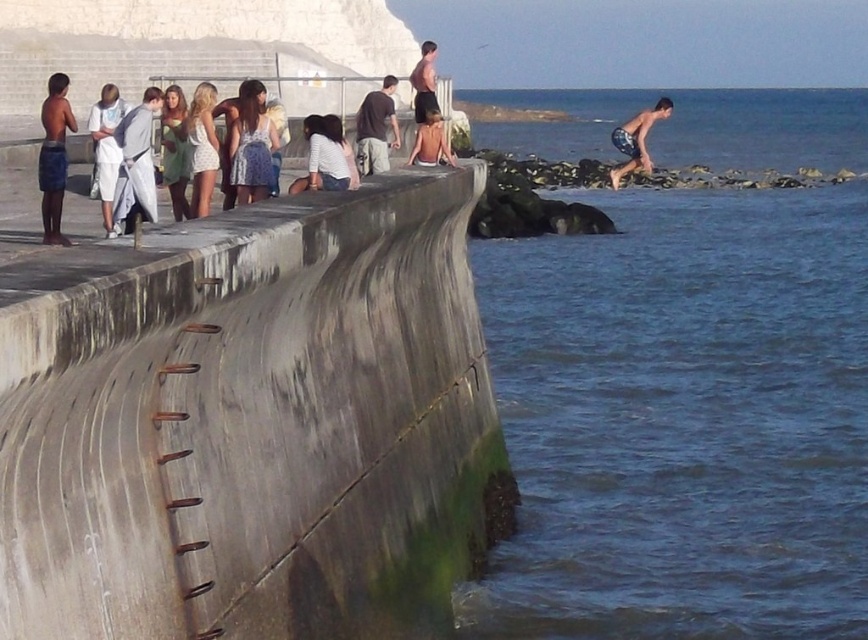
Question: Estimate the real-world distances between objects in this image. Which object is closer to the white cotton dress at left?

Choices:
 (A) matte blue shorts at left
 (B) smooth rock coast at right
 (C) matte skin at center

Answer: (A)

Question: Considering the real-world distances, which object is farthest from the matte skin at center?

Choices:
 (A) shiny black shorts at center
 (B) light gray fabric coat at left
 (C) concrete ledge at left

Answer: (B)

Question: Estimate the real-world distances between objects in this image. Which object is farther from the matte skin at center?

Choices:
 (A) white cotton dress at left
 (B) blue shorts at right

Answer: (B)

Question: Is blue water at lower right above white cotton dress at left?

Choices:
 (A) no
 (B) yes

Answer: (A)

Question: Is concrete ledge at left above denim dress at center?

Choices:
 (A) yes
 (B) no

Answer: (B)

Question: Is white cotton dress at left closer to camera compared to shiny black shorts at center?

Choices:
 (A) yes
 (B) no

Answer: (A)